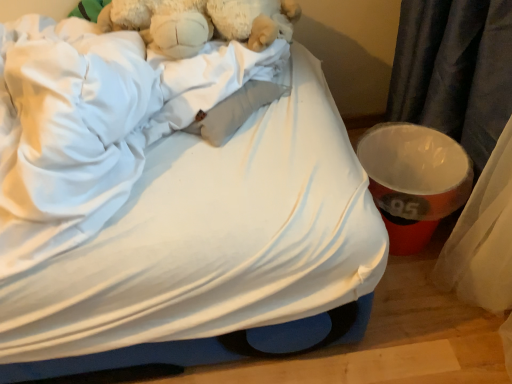
Question: From a real-world perspective, is fluffy white teddy bear at upper left over white fabric bed at upper left?

Choices:
 (A) yes
 (B) no

Answer: (A)

Question: From the image's perspective, is fluffy white teddy bear at upper left above white fabric bed at upper left?

Choices:
 (A) yes
 (B) no

Answer: (A)

Question: Considering the relative sizes of fluffy white teddy bear at upper left and white fabric bed at upper left in the image provided, is fluffy white teddy bear at upper left thinner than white fabric bed at upper left?

Choices:
 (A) yes
 (B) no

Answer: (A)

Question: Can you confirm if fluffy white teddy bear at upper left is bigger than white fabric bed at upper left?

Choices:
 (A) no
 (B) yes

Answer: (A)

Question: Is fluffy white teddy bear at upper left at the right side of white fabric bed at upper left?

Choices:
 (A) yes
 (B) no

Answer: (A)

Question: From the image's perspective, is fluffy white teddy bear at upper left located beneath white fabric bed at upper left?

Choices:
 (A) no
 (B) yes

Answer: (A)

Question: Does white fabric bed at upper left touch fluffy white teddy bear at upper left?

Choices:
 (A) yes
 (B) no

Answer: (B)

Question: Are white fabric bed at upper left and fluffy white teddy bear at upper left located far from each other?

Choices:
 (A) yes
 (B) no

Answer: (B)

Question: Can you confirm if white fabric bed at upper left is smaller than fluffy white teddy bear at upper left?

Choices:
 (A) yes
 (B) no

Answer: (B)

Question: Does white fabric bed at upper left lie in front of fluffy white teddy bear at upper left?

Choices:
 (A) no
 (B) yes

Answer: (B)

Question: From a real-world perspective, is white fabric bed at upper left below fluffy white teddy bear at upper left?

Choices:
 (A) no
 (B) yes

Answer: (B)

Question: From a real-world perspective, is white fabric bed at upper left on top of fluffy white teddy bear at upper left?

Choices:
 (A) no
 (B) yes

Answer: (A)

Question: Would you say fluffy white teddy bear at upper left is inside or outside white fabric bed at upper left?

Choices:
 (A) inside
 (B) outside

Answer: (A)